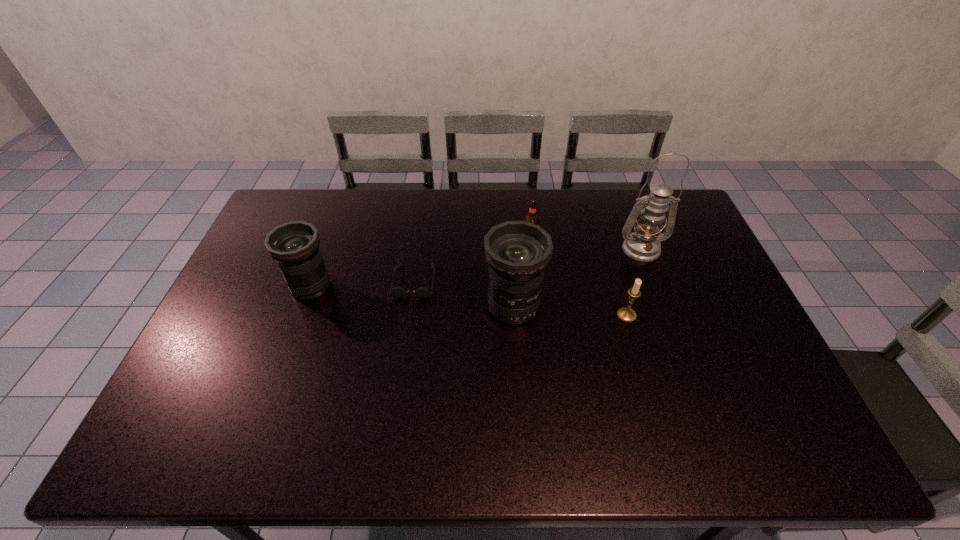
Considering the uniform spacing of telephoto lenss, where should an additional telephoto lens be positioned on the right? Please locate a free spot. Please provide its 2D coordinates. Your answer should be formatted as a tuple, i.e. [(x, y)], where the tuple contains the x and y coordinates of a point satisfying the conditions above.

[(733, 327)]